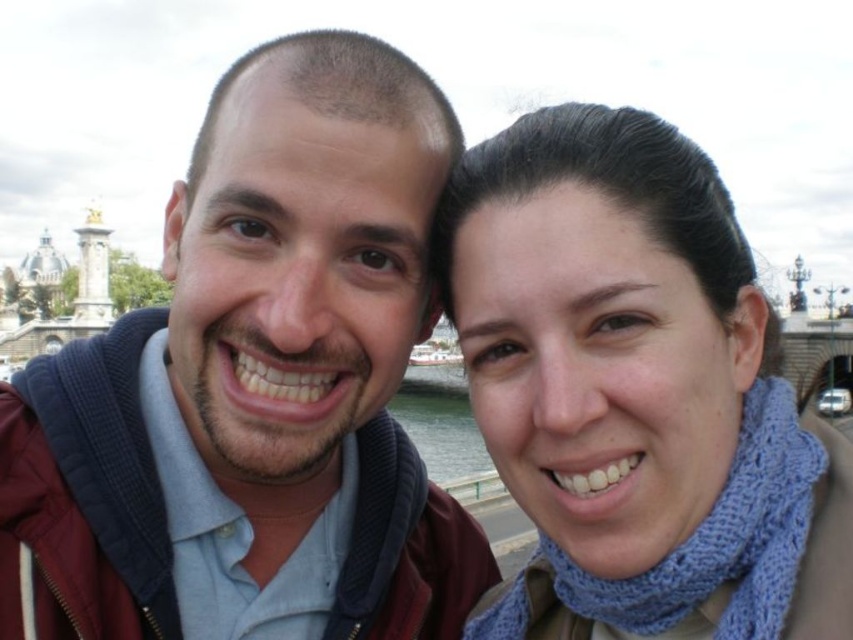
Is matte blue sweater at center smaller than clear water at lower center?

Actually, matte blue sweater at center might be larger than clear water at lower center.

I want to click on matte blue sweater at center, so click(x=254, y=387).

Is point (35, 433) more distant than point (456, 460)?

No, it is not.

Find the location of `matte blue sweater at center`. matte blue sweater at center is located at coordinates (254, 387).

Which is above, matte blue sweater at center or blue knitted scarf at upper right?

Positioned higher is matte blue sweater at center.

Is point (408, 296) positioned in front of point (585, 300)?

No, it is behind (585, 300).

Is point (245, 241) positioned in front of point (572, 289)?

No, it is behind (572, 289).

The width and height of the screenshot is (853, 640). In order to click on matte blue sweater at center in this screenshot , I will do `click(254, 387)`.

Is the position of blue knitted scarf at upper right less distant than that of clear water at lower center?

Yes, blue knitted scarf at upper right is closer to the viewer.

Can you confirm if blue knitted scarf at upper right is shorter than clear water at lower center?

In fact, blue knitted scarf at upper right may be taller than clear water at lower center.

The image size is (853, 640). Find the location of `blue knitted scarf at upper right`. blue knitted scarf at upper right is located at coordinates (634, 388).